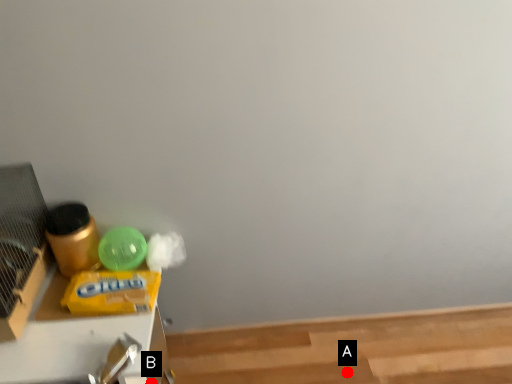
Question: Two points are circled on the image, labeled by A and B beside each circle. Which point is closer to the camera?

Choices:
 (A) A is closer
 (B) B is closer

Answer: (B)